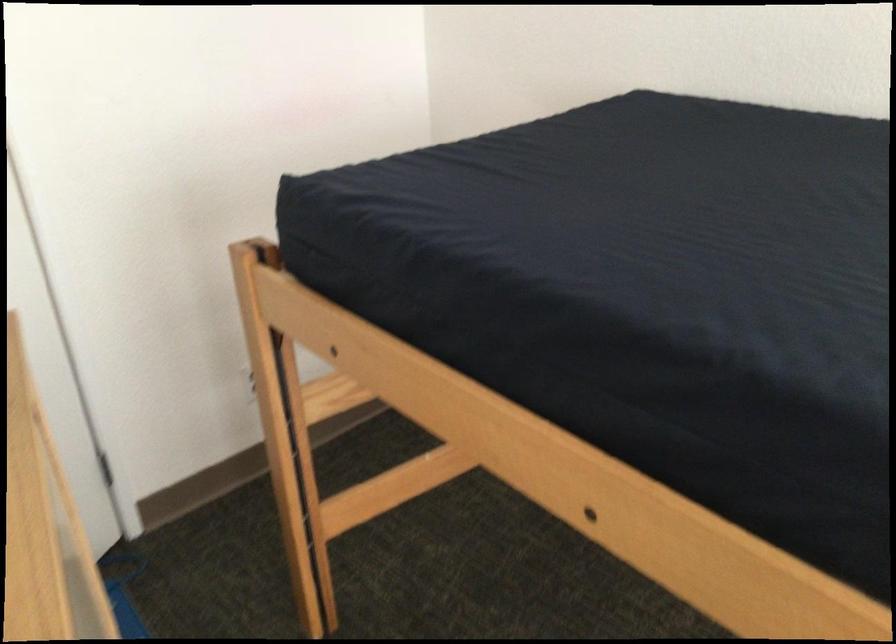
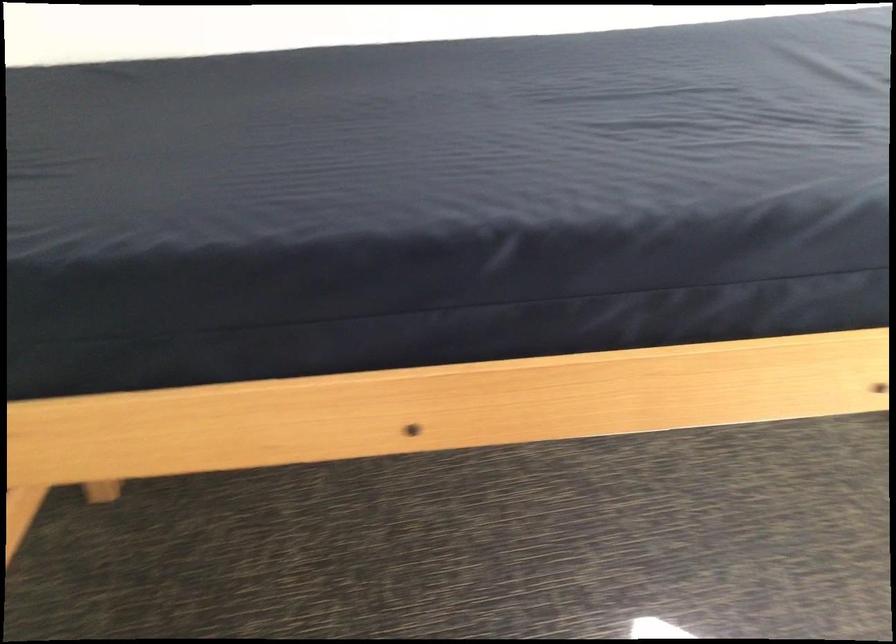
Locate, in the second image, the point that corresponds to pixel 435 401 in the first image.

(165, 436)